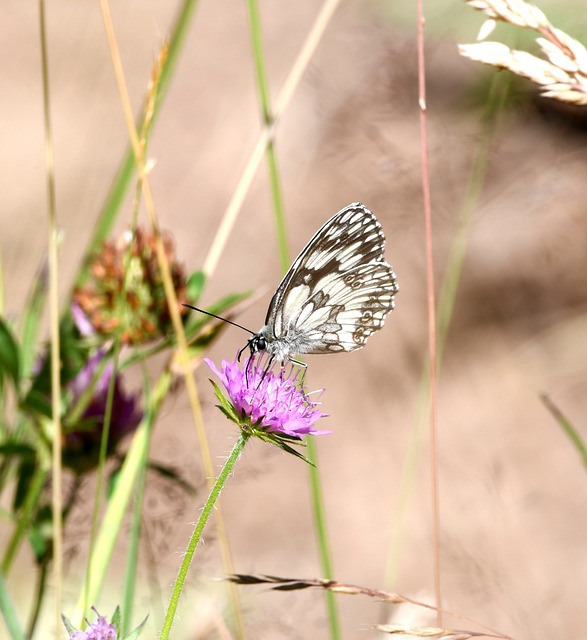
Locate an element on the screen. This screenshot has height=640, width=587. bright plant is located at coordinates (576, 64).